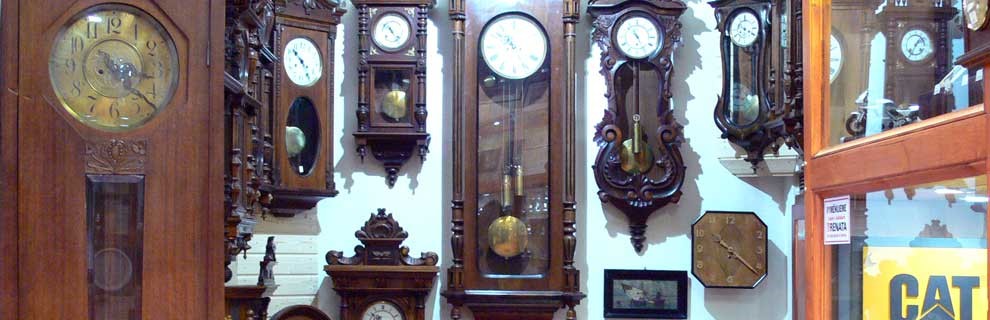
Identify the location of clocks with a white face. (302, 52), (380, 25), (495, 30), (632, 31), (752, 31), (925, 37), (838, 58), (389, 305).